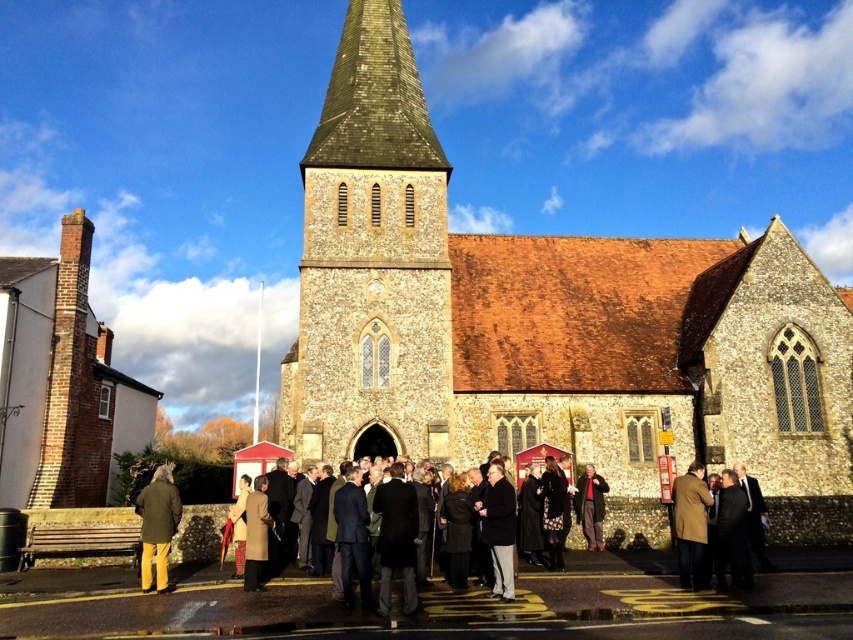
Question: Is brick chimney at left above dark brown leather coat at center?

Choices:
 (A) no
 (B) yes

Answer: (B)

Question: Among these objects, which one is farthest from the camera?

Choices:
 (A) brown stone tower at center
 (B) brown wool coat at center
 (C) dark gray suit at center

Answer: (A)

Question: Which of these objects is positioned closest to the dark suit at lower right?

Choices:
 (A) dark brown leather coat at center
 (B) brown stone tower at center
 (C) brick chimney at left
 (D) matte black suit at center

Answer: (D)

Question: Which point is farther to the camera?

Choices:
 (A) (512, 522)
 (B) (146, 516)
 (C) (7, 380)

Answer: (C)

Question: Is brick chimney at left bigger than brown wool coat at center?

Choices:
 (A) no
 (B) yes

Answer: (B)

Question: Can you confirm if brick chimney at left is positioned to the left of matte black suit at center?

Choices:
 (A) yes
 (B) no

Answer: (A)